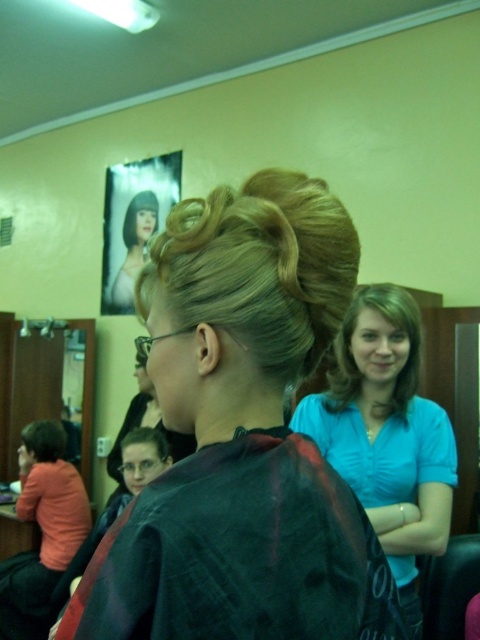
Between blonde hair at upper center and short dark hair at lower left, which one is positioned lower?

Positioned lower is short dark hair at lower left.

Does blonde hair at upper center come behind short dark hair at lower left?

Yes, it is behind short dark hair at lower left.

The image size is (480, 640). Identify the location of blonde hair at upper center. (133, 248).

Can you confirm if light brown silky hair at center is positioned above blonde silky hair at center?

Correct, light brown silky hair at center is located above blonde silky hair at center.

Which of these two, light brown silky hair at center or blonde silky hair at center, stands shorter?

blonde silky hair at center

Which is behind, point (397, 296) or point (159, 452)?

Point (159, 452)

Locate an element on the screen. This screenshot has width=480, height=640. light brown silky hair at center is located at coordinates (351, 355).

Between point (342, 404) and point (165, 456), which one is positioned in front?

Point (342, 404) is in front.

From the picture: Who is positioned more to the right, blue matte shirt at center or blonde silky hair at center?

From the viewer's perspective, blue matte shirt at center appears more on the right side.

Who is more distant from viewer, (371, 518) or (168, 449)?

The point (168, 449) is behind.

Where is `blue matte shirt at center`? blue matte shirt at center is located at coordinates (386, 433).